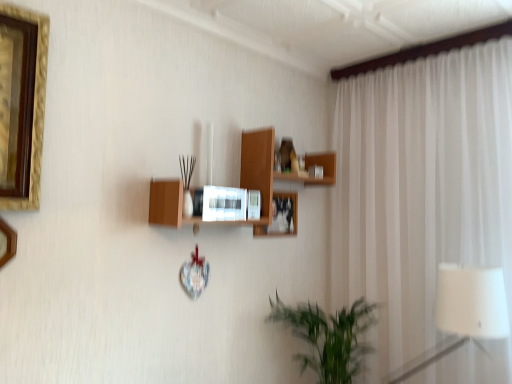
Question: Is matte white picture frame at center, the 1th picture frame in the right-to-left sequence, to the right of white sheer curtain at right from the viewer's perspective?

Choices:
 (A) yes
 (B) no

Answer: (B)

Question: Is matte white picture frame at center, positioned as the 1th picture frame in back-to-front order, far away from white sheer curtain at right?

Choices:
 (A) yes
 (B) no

Answer: (B)

Question: Is matte white picture frame at center, the second picture frame in the front-to-back sequence, thinner than white sheer curtain at right?

Choices:
 (A) no
 (B) yes

Answer: (B)

Question: Is matte white picture frame at center, placed as the 2th picture frame when sorted from left to right, bigger than white sheer curtain at right?

Choices:
 (A) yes
 (B) no

Answer: (B)

Question: From a real-world perspective, is matte white picture frame at center, positioned as the 1th picture frame in back-to-front order, under white sheer curtain at right?

Choices:
 (A) yes
 (B) no

Answer: (B)

Question: Is matte white picture frame at center, positioned as the 1th picture frame in back-to-front order, looking in the opposite direction of white sheer curtain at right?

Choices:
 (A) no
 (B) yes

Answer: (A)

Question: From the image's perspective, is gold-framed picture at left, placed as the first picture frame when sorted from front to back, below white fabric lampshade at right?

Choices:
 (A) no
 (B) yes

Answer: (A)

Question: Is gold-framed picture at left, marked as the 1th picture frame in a left-to-right arrangement, bigger than white fabric lampshade at right?

Choices:
 (A) yes
 (B) no

Answer: (B)

Question: From the image's perspective, does gold-framed picture at left, which ranks as the 2th picture frame in back-to-front order, appear higher than white fabric lampshade at right?

Choices:
 (A) yes
 (B) no

Answer: (A)

Question: Considering the relative sizes of gold-framed picture at left, marked as the 1th picture frame in a left-to-right arrangement, and white fabric lampshade at right in the image provided, is gold-framed picture at left, marked as the 1th picture frame in a left-to-right arrangement, taller than white fabric lampshade at right?

Choices:
 (A) yes
 (B) no

Answer: (B)

Question: Could you tell me if gold-framed picture at left, which ranks as the 2th picture frame in back-to-front order, is turned towards white fabric lampshade at right?

Choices:
 (A) yes
 (B) no

Answer: (B)

Question: Is gold-framed picture at left, placed as the first picture frame when sorted from front to back, beside white fabric lampshade at right?

Choices:
 (A) yes
 (B) no

Answer: (B)

Question: Considering the relative sizes of white sheer curtain at right and wooden microwave at center in the image provided, is white sheer curtain at right taller than wooden microwave at center?

Choices:
 (A) no
 (B) yes

Answer: (B)